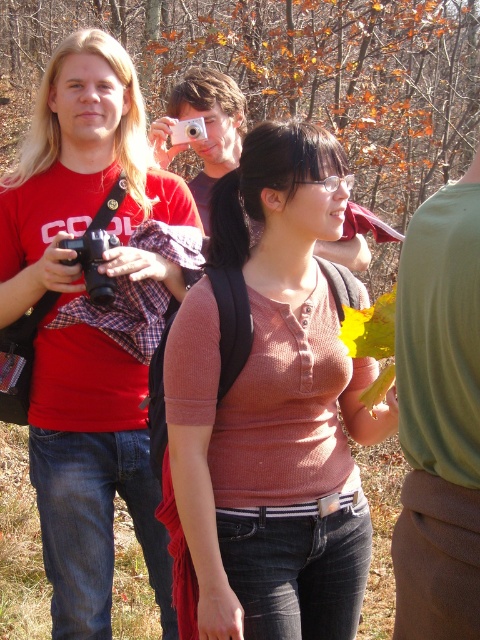
Which of these two, matte black camera at left or black plastic camera at left, stands shorter?

black plastic camera at left

Between matte black camera at left and black plastic camera at left, which one is positioned lower?

matte black camera at left is lower down.

What do you see at coordinates (86, 324) in the screenshot? I see `matte black camera at left` at bounding box center [86, 324].

Where is `matte black camera at left`? Image resolution: width=480 pixels, height=640 pixels. matte black camera at left is located at coordinates (86, 324).

Who is higher up, pink knitted sweater at center or matte silver camera at upper center?

matte silver camera at upper center is above.

Based on the photo, can you confirm if pink knitted sweater at center is taller than matte silver camera at upper center?

Correct, pink knitted sweater at center is much taller as matte silver camera at upper center.

Between point (296, 269) and point (207, 92), which one is positioned in front?

Point (296, 269) is more forward.

Image resolution: width=480 pixels, height=640 pixels. Find the location of `pink knitted sweater at center`. pink knitted sweater at center is located at coordinates (273, 406).

Looking at this image, is pink knitted sweater at center bigger than matte black camera at left?

No.

Does pink knitted sweater at center come behind matte black camera at left?

No, pink knitted sweater at center is closer to the viewer.

This screenshot has width=480, height=640. What do you see at coordinates (273, 406) in the screenshot? I see `pink knitted sweater at center` at bounding box center [273, 406].

At what (x,y) coordinates should I click in order to perform the action: click on pink knitted sweater at center. Please return your answer as a coordinate pair (x, y). The height and width of the screenshot is (640, 480). Looking at the image, I should click on (273, 406).